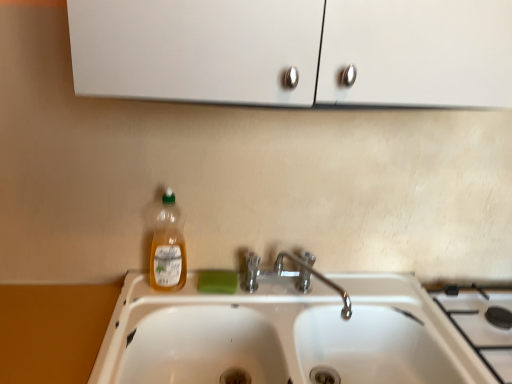
Question: In the image, is green matte soap at sink positioned in front of or behind chrome metallic faucet at sink center?

Choices:
 (A) behind
 (B) front

Answer: (A)

Question: Is green matte soap at sink inside the boundaries of chrome metallic faucet at sink center, or outside?

Choices:
 (A) outside
 (B) inside

Answer: (A)

Question: Based on their relative distances, which object is nearer to the chrome metallic faucet at sink center?

Choices:
 (A) white glossy sink at center
 (B) green matte soap at sink
 (C) white ceramic gas stove at lower right
 (D) translucent plastic bottle at center

Answer: (B)

Question: Which of these objects is positioned farthest from the white glossy sink at center?

Choices:
 (A) green matte soap at sink
 (B) translucent plastic bottle at center
 (C) white ceramic gas stove at lower right
 (D) chrome metallic faucet at sink center

Answer: (C)